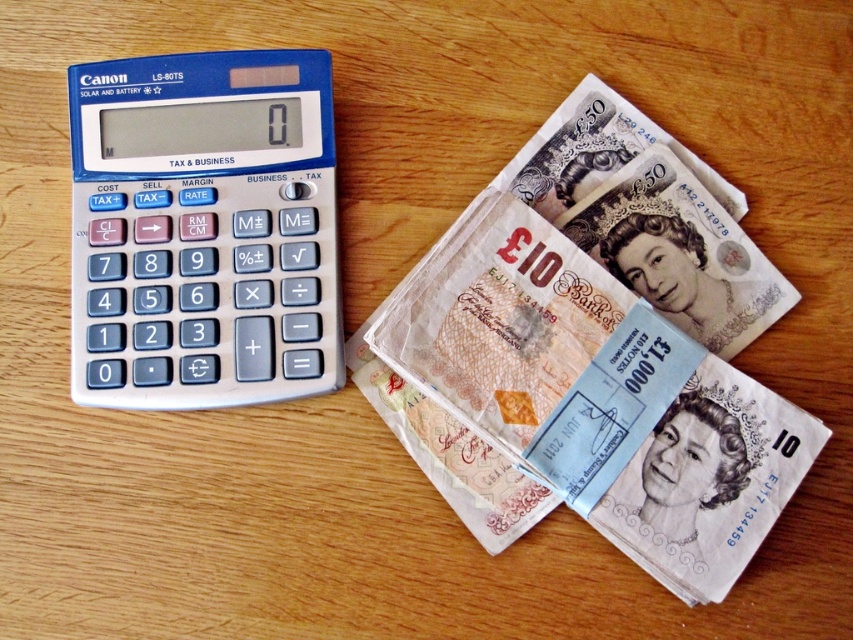
Question: Does smooth paper £10 notes at center have a larger size compared to blue plastic calculator at left?

Choices:
 (A) yes
 (B) no

Answer: (A)

Question: Is smooth paper £10 notes at center closer to the viewer compared to blue plastic calculator at left?

Choices:
 (A) no
 (B) yes

Answer: (B)

Question: Can you confirm if smooth paper £10 notes at center is wider than blue plastic calculator at left?

Choices:
 (A) no
 (B) yes

Answer: (B)

Question: Which object is closer to the camera taking this photo?

Choices:
 (A) smooth paper £10 notes at center
 (B) blue plastic calculator at left

Answer: (A)